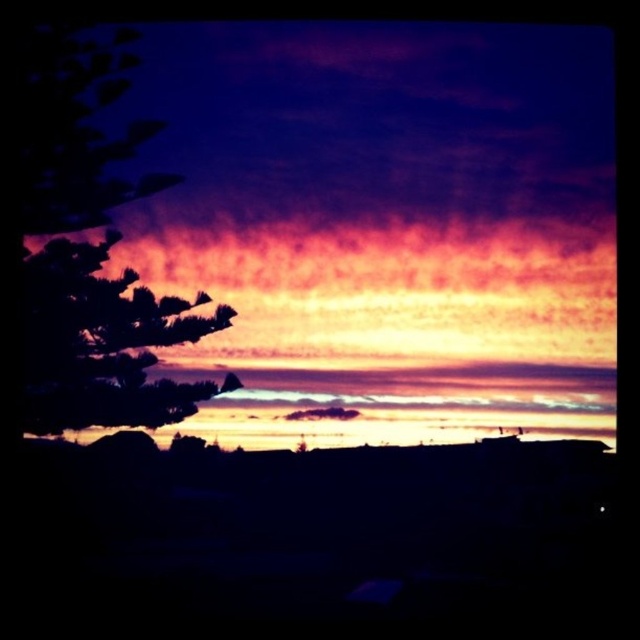
You are an astronomer analyzing the sunset scene. You notice a specific point at coordinates point [384,224]. What object is located there?

The purple matte cloud at upper center is located at point [384,224].

You are an artist trying to paint the sunset scene. You want to ensure the purple matte cloud at upper center and the silhouette leafy tree at left are proportionally accurate. Which object should you paint larger?

The purple matte cloud at upper center should be painted larger than the silhouette leafy tree at left because it is described as larger in size.

You are an artist trying to paint the sunset scene. You notice two trees on the left side of the image. Which tree has a narrower width? Please choose between the dark purple leafy tree at left and the silhouette leafy tree at left.

The dark purple leafy tree at left has a narrower width than the silhouette leafy tree at left according to the description.